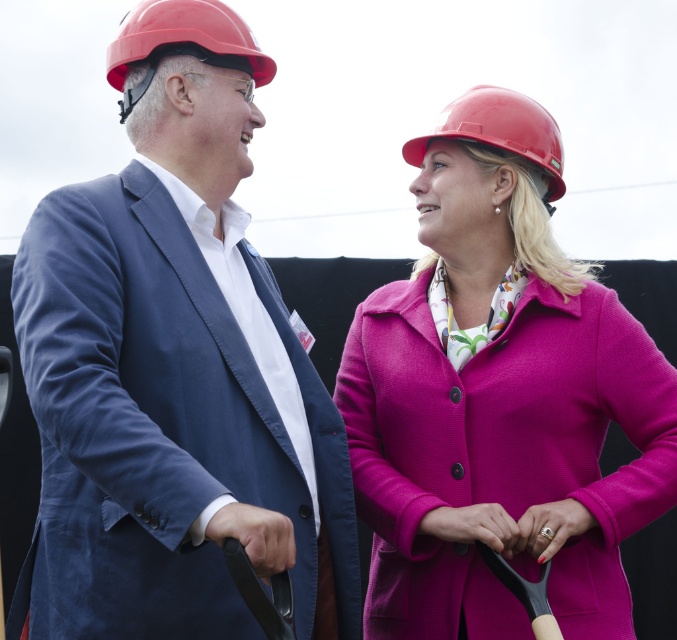
Based on the photo, is red hard hat at upper center wider than gold ring at center?

Yes.

Who is taller, red hard hat at upper center or gold ring at center?

With more height is red hard hat at upper center.

Does point (540, 163) lie in front of point (540, 541)?

No, it is behind (540, 541).

The height and width of the screenshot is (640, 677). I want to click on red hard hat at upper center, so click(x=500, y=129).

Can you confirm if suede-like blue suit at left is taller than black rubber handle at lower left?

Indeed, suede-like blue suit at left has a greater height compared to black rubber handle at lower left.

Does point (49, 545) come closer to viewer compared to point (240, 541)?

No, (49, 545) is behind (240, 541).

Locate an element on the screen. The width and height of the screenshot is (677, 640). suede-like blue suit at left is located at coordinates (171, 365).

You are a GUI agent. You are given a task and a screenshot of the screen. Output one action in this format:
    pyautogui.click(x=<x>, y=<y>)
    Task: Click on the suede-like blue suit at left
    
    Given the screenshot: What is the action you would take?
    pyautogui.click(x=171, y=365)

Between point (452, 116) and point (253, 54), which one is positioned in front?

Point (253, 54)

Can you confirm if red hard hat at upper center is positioned above matte red hard hat at upper left?

No, red hard hat at upper center is not above matte red hard hat at upper left.

Is point (536, 125) less distant than point (108, 52)?

That is False.

Where is `red hard hat at upper center`? This screenshot has height=640, width=677. red hard hat at upper center is located at coordinates (500, 129).